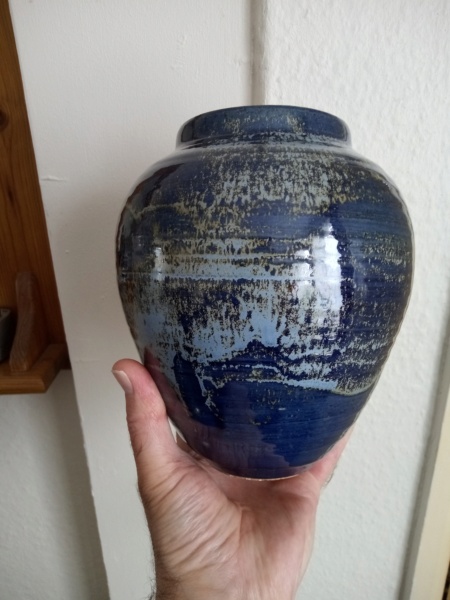
You are a GUI agent. You are given a task and a screenshot of the screen. Output one action in this format:
    pyautogui.click(x=<x>, y=<y>)
    Task: Click on the moulding
    
    Given the screenshot: What is the action you would take?
    pyautogui.click(x=436, y=578)